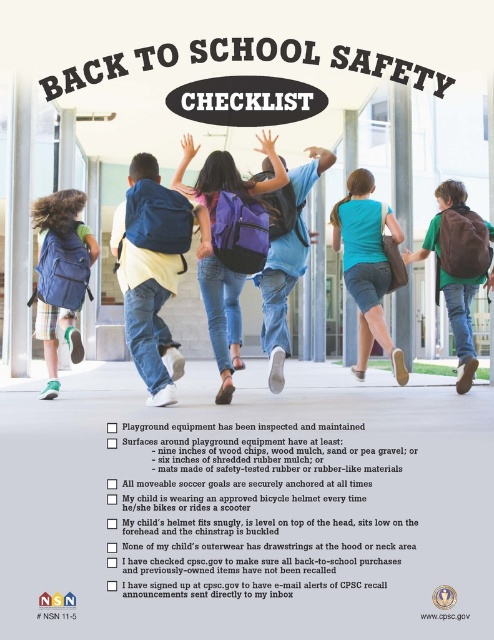
You are a parent looking at the poster and want to locate the teal fabric backpack at center. Where should you look on the poster?

The teal fabric backpack at center is located at point (x=367, y=266) on the poster.

You are a parent standing at the school entrance and see your child running with the teal fabric backpack at center. If the school requires all backpacks to be within 20 feet of the entrance for safety, is your child compliant with the rule?

The teal fabric backpack at center is 22.64 feet away from the viewer, which exceeds the 20 feet requirement, so the child is not compliant with the safety rule.

You are a parent looking at the poster and want to know which point is closer to you. The poster has two points marked as point 1 at coordinates point (358, 305) and point 2 at coordinates point (449, 218). Which point is closer to you?

Point (358, 305) is closer to you because it is further to the viewer than point (449, 218).